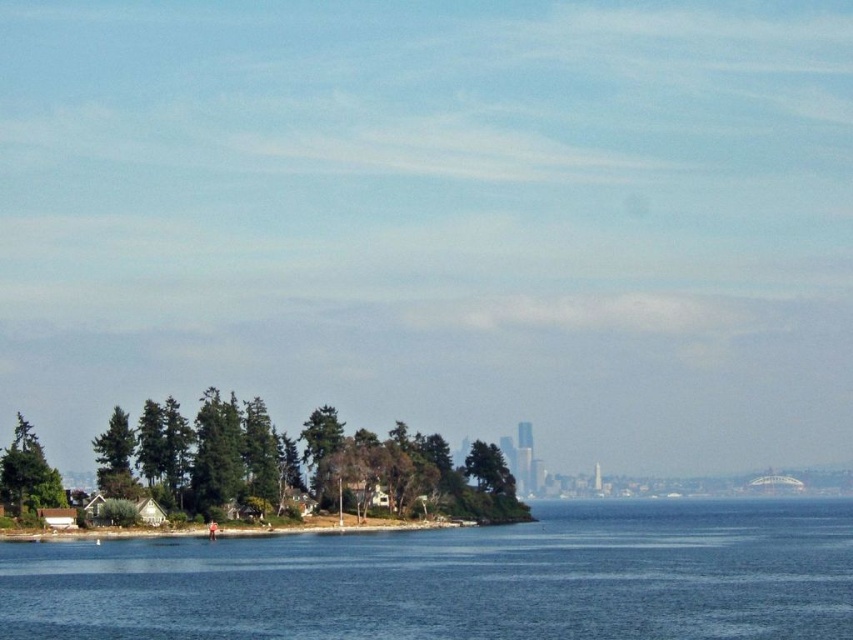
Does green matte tree at lower left have a greater height compared to green matte tree at left?

Yes, green matte tree at lower left is taller than green matte tree at left.

Can you confirm if green matte tree at lower left is positioned above green matte tree at left?

Yes.

Between point (45, 481) and point (134, 484), which one is positioned in front?

Point (45, 481) is more forward.

Find the location of a particular element. green matte tree at lower left is located at coordinates (28, 472).

Is blue water at lower center shorter than green matte tree at left?

Incorrect, blue water at lower center's height does not fall short of green matte tree at left's.

Is point (93, 570) positioned behind point (109, 456)?

No, it is in front of (109, 456).

Does point (837, 593) come in front of point (103, 484)?

Yes, it is.

In order to click on blue water at lower center in this screenshot , I will do `click(460, 579)`.

Can you confirm if blue water at lower center is shorter than green matte tree at lower left?

No, blue water at lower center is not shorter than green matte tree at lower left.

Is point (380, 547) closer to viewer compared to point (32, 426)?

Yes, it is.

Image resolution: width=853 pixels, height=640 pixels. I want to click on blue water at lower center, so click(x=460, y=579).